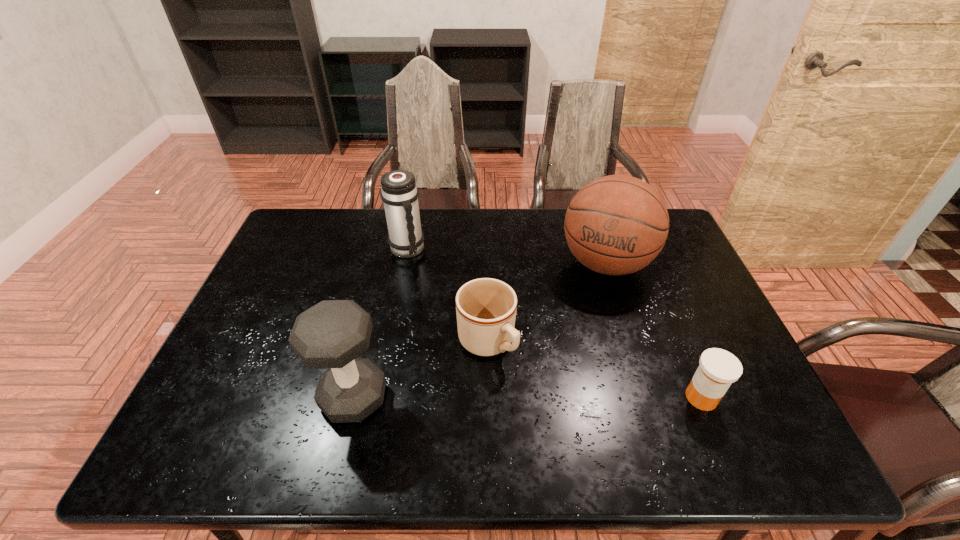
Locate an element on the screen. free space on the desktop that is between the dumbbell and the medicine and is positioned on the side with the handle of the thermos bottle is located at coordinates (557, 397).

This screenshot has width=960, height=540. Identify the location of free space on the desktop that is between the dumbbell and the medicine and is positioned on the side of the third farthest object with the handle. (536, 397).

Image resolution: width=960 pixels, height=540 pixels. What are the coordinates of `free space on the desktop that is between the dumbbell and the medicine and is positioned on the side with brand label of the basketball` in the screenshot? It's located at (557, 397).